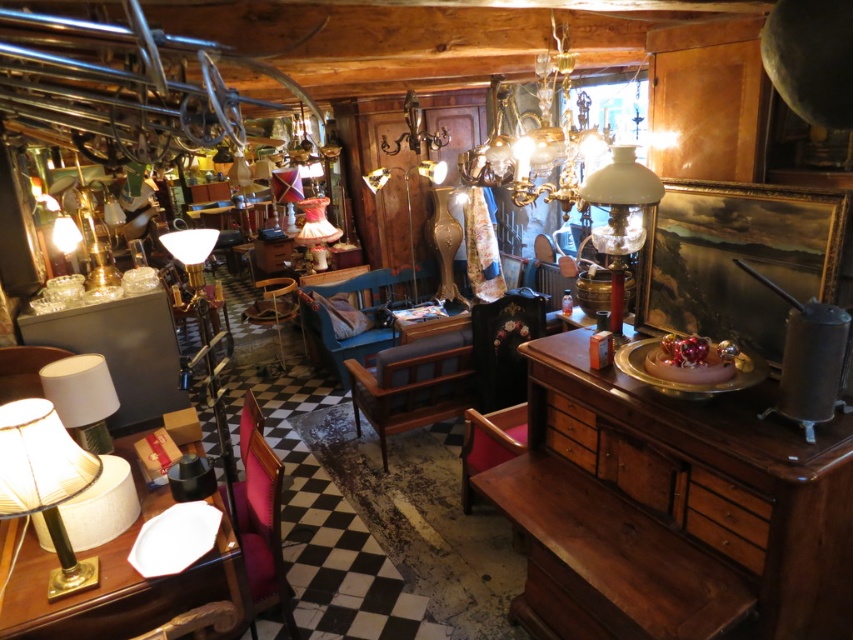
You are standing at point (262, 580) and want to walk to point (361, 388). Is the destination point behind you or in front of you?

The destination point (361, 388) is behind point (262, 580), so it is behind you.

You are a customer in the antique shop and want to place a tall potted plant on the wooden dresser at right or the velvet blue chair at center. Which surface can accommodate the plant without it toppling over?

The wooden dresser at right has a greater height compared to velvet blue chair at center, so it can accommodate the tall potted plant without it toppling over.